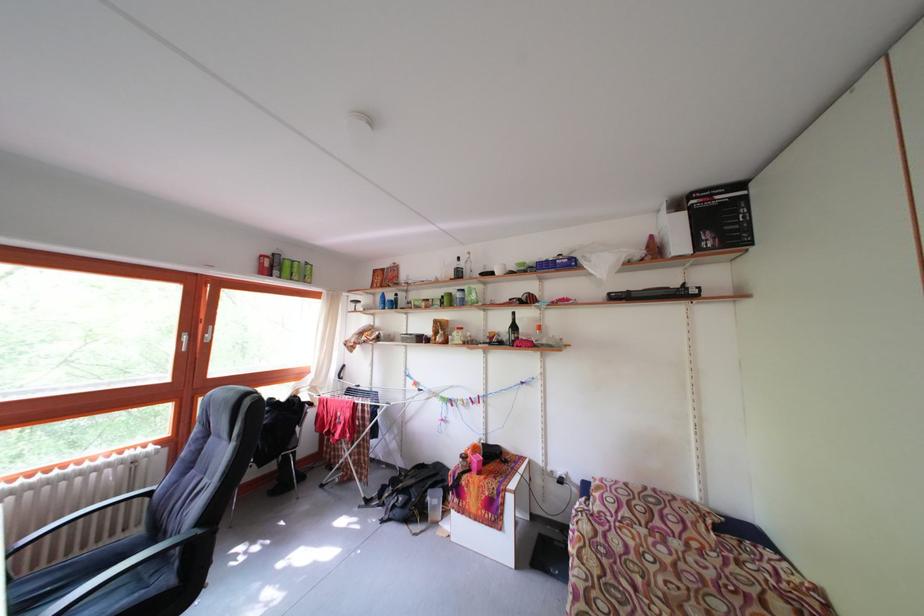
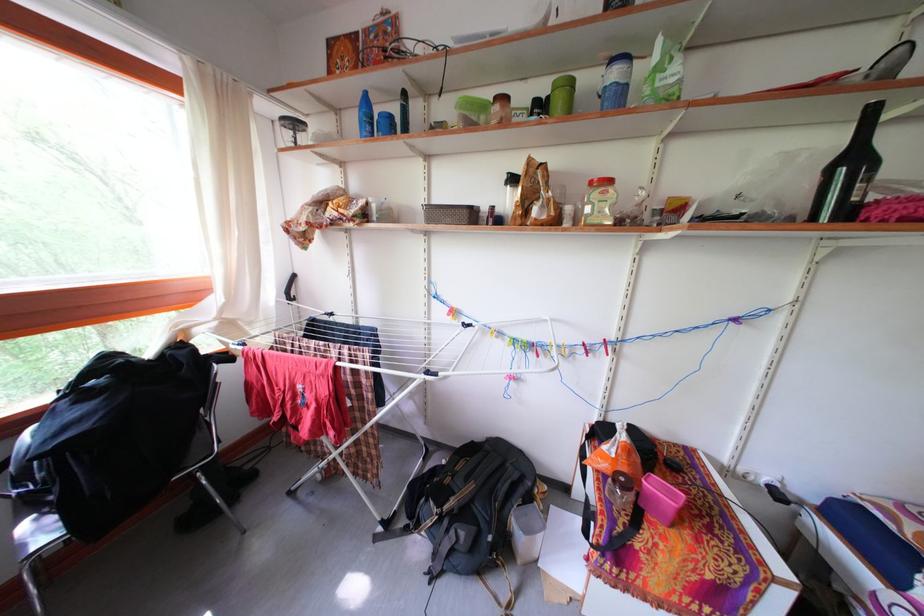
Where in the second image is the point corresponding to pixel 467 301 from the first image?

(623, 81)